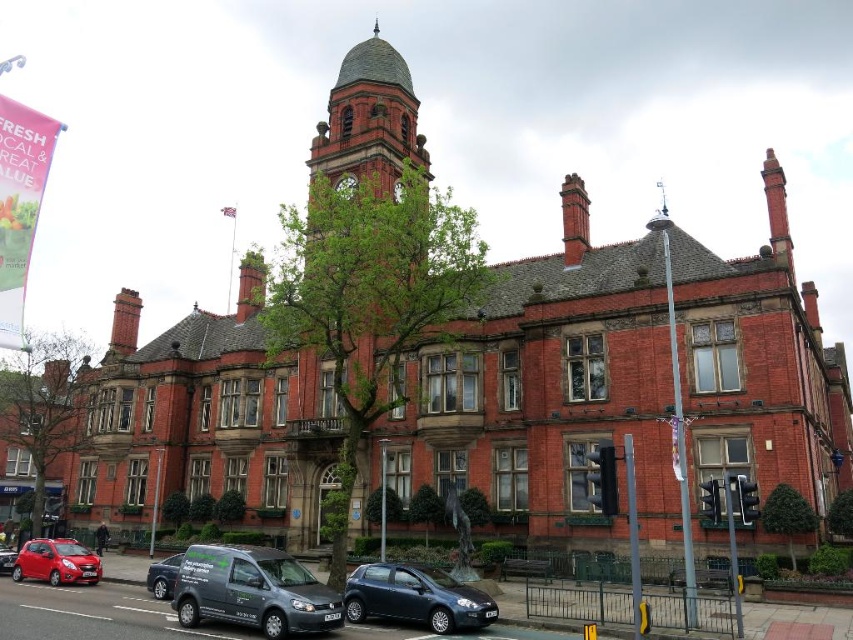
Which is in front, point (361, 596) or point (173, 579)?

Point (361, 596) is in front.

Is point (454, 580) positioned after point (167, 563)?

No, it is not.

This screenshot has width=853, height=640. What do you see at coordinates (415, 596) in the screenshot? I see `metallic blue hatchback at lower center` at bounding box center [415, 596].

The image size is (853, 640). I want to click on metallic blue hatchback at lower center, so click(415, 596).

This screenshot has width=853, height=640. Describe the element at coordinates (252, 589) in the screenshot. I see `matte gray van at lower center` at that location.

Locate an element on the screen. This screenshot has width=853, height=640. matte gray van at lower center is located at coordinates (252, 589).

Can you confirm if matte gray van at lower center is positioned to the left of metallic blue hatchback at lower center?

Yes, matte gray van at lower center is to the left of metallic blue hatchback at lower center.

Does matte gray van at lower center have a lesser width compared to metallic blue hatchback at lower center?

In fact, matte gray van at lower center might be wider than metallic blue hatchback at lower center.

Is point (248, 604) behind point (416, 586)?

No, it is not.

I want to click on matte gray van at lower center, so click(x=252, y=589).